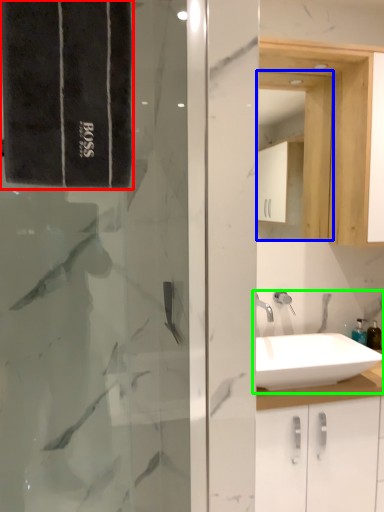
Question: Estimate the real-world distances between objects in this image. Which object is closer to bath towel (highlighted by a red box), medicine cabinet (highlighted by a blue box) or sink (highlighted by a green box)?

Choices:
 (A) medicine cabinet
 (B) sink

Answer: (B)